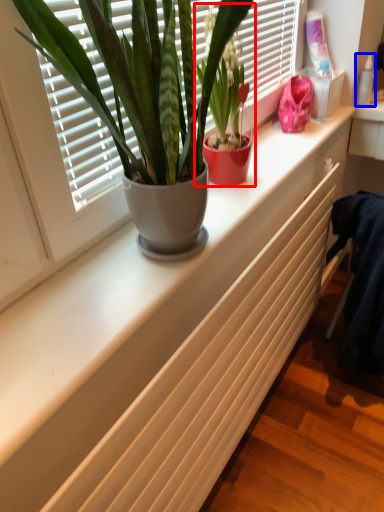
Question: Which object is further to the camera taking this photo, houseplant (highlighted by a red box) or toiletry (highlighted by a blue box)?

Choices:
 (A) houseplant
 (B) toiletry

Answer: (B)